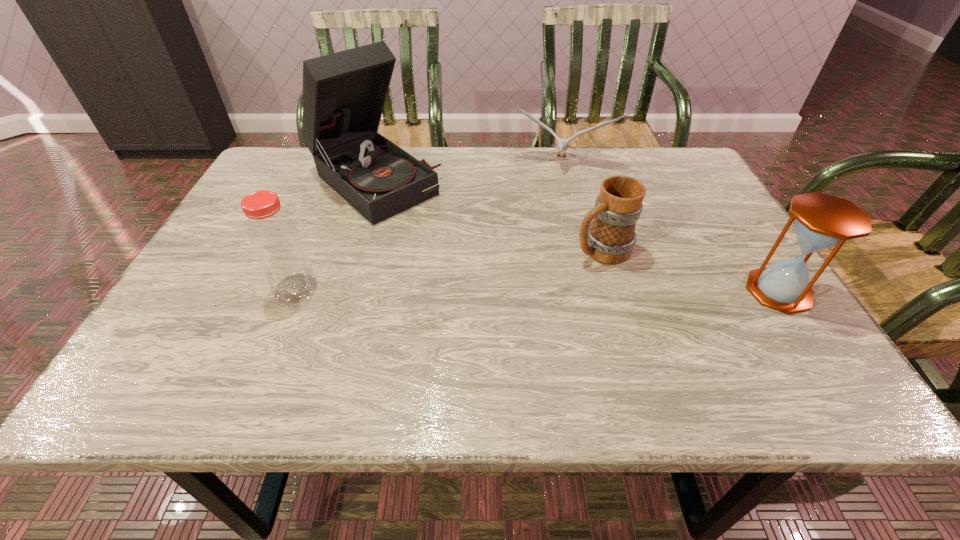
The image size is (960, 540). Identify the location of free space on the desktop that is between the bottle and the hourglass and is positioned at the tip of the beak of the gull. pos(529,289).

You are a GUI agent. You are given a task and a screenshot of the screen. Output one action in this format:
    pyautogui.click(x=<x>, y=<y>)
    Task: Click on the vacant space on the desktop that is between the bottle and the rightmost object and is positioned on the side of the mug with the handle
    The width and height of the screenshot is (960, 540).
    Given the screenshot: What is the action you would take?
    pyautogui.click(x=520, y=289)

Locate an element on the screen. free spot on the desktop that is between the bottle and the rightmost object and is positioned on the front-facing side of the phonograph_record is located at coordinates (509, 289).